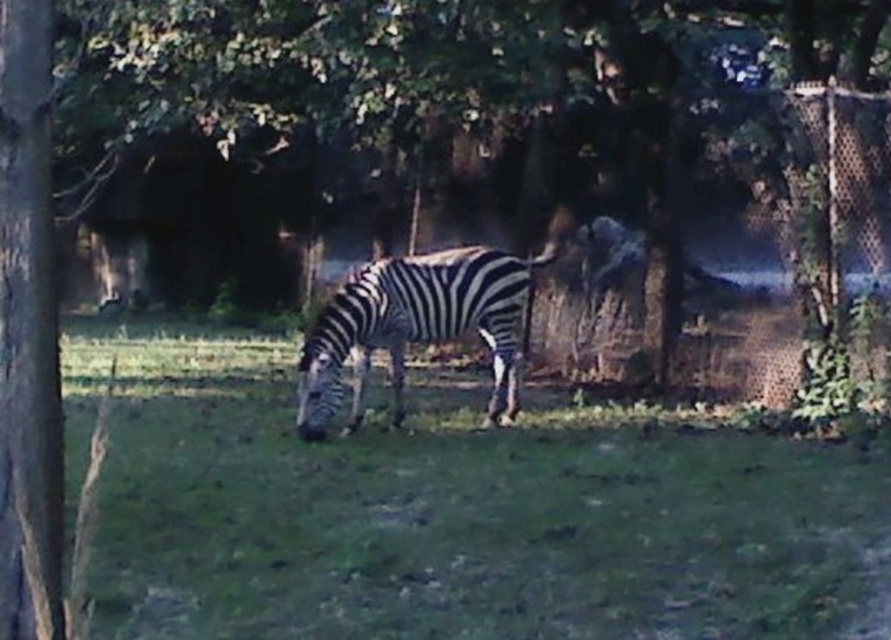
Question: Is the position of green grassy at center less distant than that of black and white striped zebra at center?

Choices:
 (A) no
 (B) yes

Answer: (B)

Question: Which point is farther from the camera taking this photo?

Choices:
 (A) (430, 296)
 (B) (524, 614)

Answer: (A)

Question: Does green grassy at center appear over black and white striped zebra at center?

Choices:
 (A) no
 (B) yes

Answer: (A)

Question: Is green grassy at center wider than black and white striped zebra at center?

Choices:
 (A) yes
 (B) no

Answer: (A)